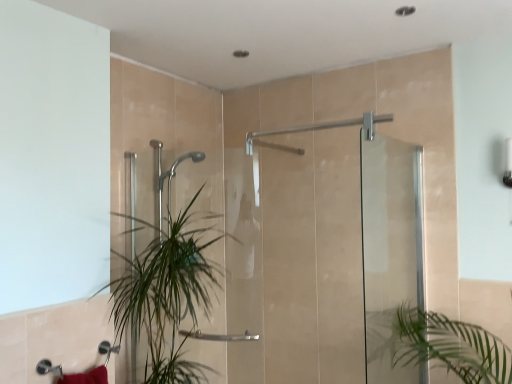
Question: Considering the relative positions of transparent glass screen door at right, the 1th screen door in the right-to-left sequence, and green leafy plant at center in the image provided, is transparent glass screen door at right, the 1th screen door in the right-to-left sequence, to the left or to the right of green leafy plant at center?

Choices:
 (A) left
 (B) right

Answer: (B)

Question: From a real-world perspective, is transparent glass screen door at right, which is counted as the second screen door, starting from the left, positioned above or below green leafy plant at center?

Choices:
 (A) above
 (B) below

Answer: (A)

Question: Considering the real-world distances, which object is farthest from the green leafy plant at center?

Choices:
 (A) clear glass shower door at center, which ranks as the second screen door in right-to-left order
 (B) transparent glass screen door at right, which is counted as the second screen door, starting from the left

Answer: (B)

Question: Which is nearer to the clear glass shower door at center, the first screen door when ordered from left to right?

Choices:
 (A) green leafy plant at center
 (B) transparent glass screen door at right, the 1th screen door in the right-to-left sequence

Answer: (B)